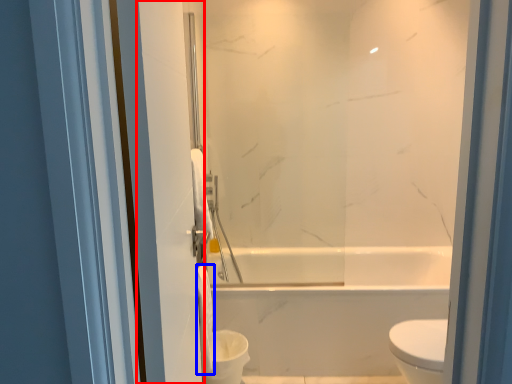
Question: Which point is further to the camera, screen door (highlighted by a red box) or toilet paper (highlighted by a blue box)?

Choices:
 (A) screen door
 (B) toilet paper

Answer: (B)